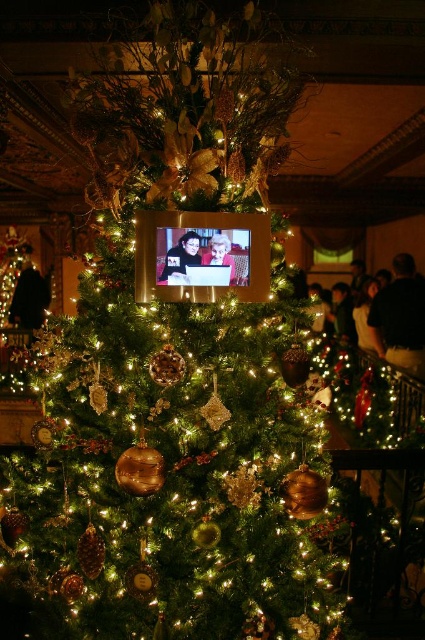
You are setting up a Christmas tree and want to place a matte black frame at center and a matte black laptop at upper center. Given that the distance between them must be at least 2 inches to avoid overcrowding, will the current placement work?

The matte black frame at center is only 1.85 inches from the matte black laptop at upper center, which is less than the required 2 inches. Therefore, the current placement is too close and may cause overcrowding.

Consider the image. You are standing in front of the Christmas tree and want to place a new ornament. There is a matte black frame at center located at point (181, 257). Can you hang another ornament near that point without overlapping?

The matte black frame at center is already located at point (181, 257), so hanging another ornament there may cause overlap. Consider placing it slightly to the side or another area of the tree.